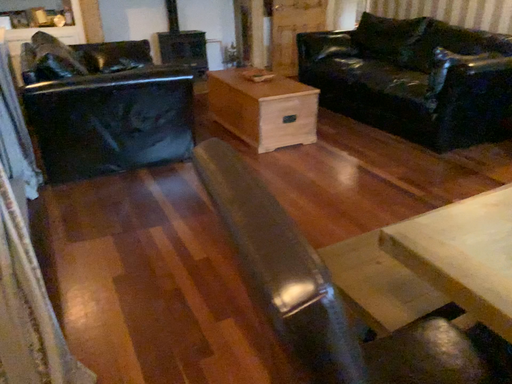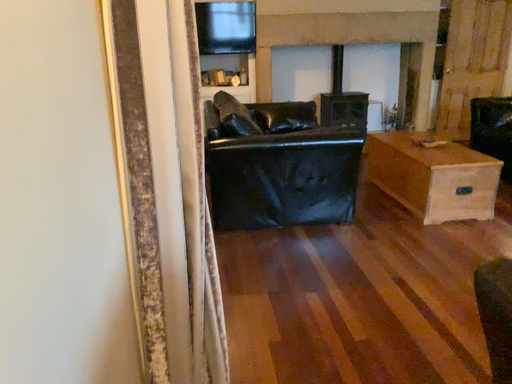
Question: Which way did the camera rotate in the video?

Choices:
 (A) rotated downward
 (B) rotated upward

Answer: (B)